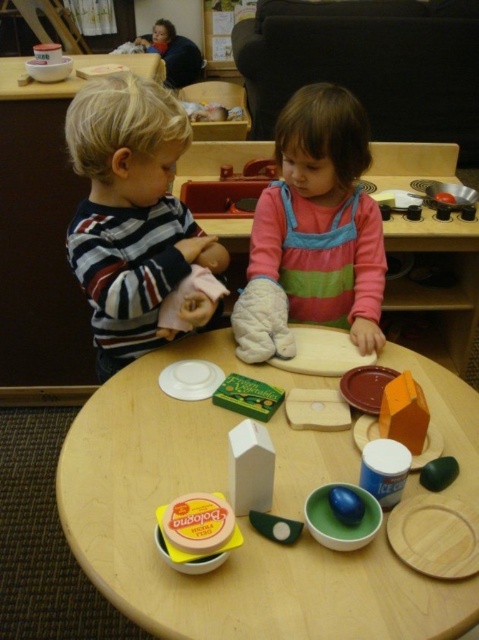
Between wooden toy at center and striped cotton shirt at left, which one has more height?

striped cotton shirt at left

Is point (90, 541) in front of point (103, 132)?

That is True.

Where is `wooden toy at center`? The height and width of the screenshot is (640, 479). wooden toy at center is located at coordinates (239, 524).

Between point (327, 632) and point (280, 216), which one is positioned behind?

The point (280, 216) is behind.

Based on the photo, does wooden toy at center have a larger size compared to pink striped dress at center?

Correct, wooden toy at center is larger in size than pink striped dress at center.

Who is more distant from viewer, [274,608] or [294,291]?

Point [294,291]

In order to click on wooden toy at center in this screenshot , I will do `click(239, 524)`.

Between striped cotton shirt at left and pink striped dress at center, which one has more height?

With more height is striped cotton shirt at left.

What do you see at coordinates (130, 212) in the screenshot? I see `striped cotton shirt at left` at bounding box center [130, 212].

At what (x,y) coordinates should I click in order to perform the action: click on striped cotton shirt at left. Please return your answer as a coordinate pair (x, y). This screenshot has width=479, height=640. Looking at the image, I should click on (130, 212).